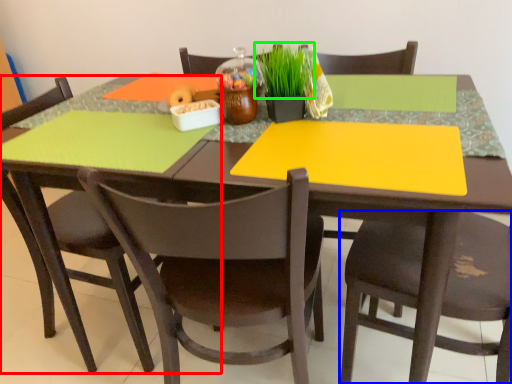
Question: Based on their relative distances, which object is nearer to chair (highlighted by a red box)? Choose from chair (highlighted by a blue box) and plant (highlighted by a green box).

Choices:
 (A) chair
 (B) plant

Answer: (B)